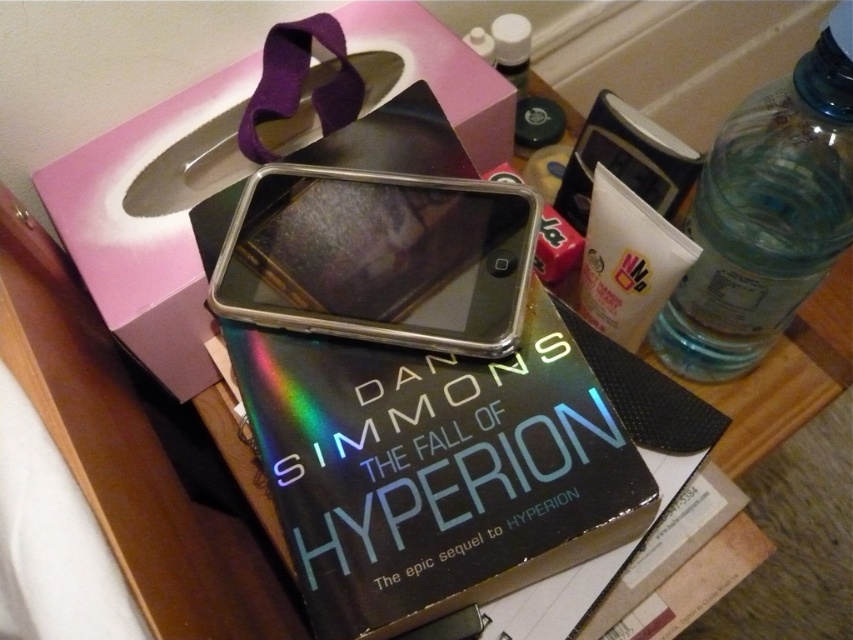
Between point (235, 316) and point (672, 321), which one is positioned in front?

Point (235, 316) is in front.

Can you confirm if clear plastic phone at center is bigger than clear plastic bottle at right?

Incorrect, clear plastic phone at center is not larger than clear plastic bottle at right.

Who is more distant from viewer, (277,214) or (703,253)?

Point (703,253)

I want to click on clear plastic phone at center, so click(379, 259).

Who is more forward, (225, 326) or (819, 68)?

Positioned in front is point (819, 68).

Does point (254, 410) lie behind point (787, 198)?

No, (254, 410) is closer to viewer.

Where is `holographic hardcover book at center`? Image resolution: width=853 pixels, height=640 pixels. holographic hardcover book at center is located at coordinates (434, 468).

Is point (260, 365) less distant than point (387, 186)?

Yes, point (260, 365) is in front of point (387, 186).

Is holographic hardcover book at center wider than clear plastic phone at center?

Yes.

Identify the location of holographic hardcover book at center. This screenshot has width=853, height=640. (434, 468).

Where is `holographic hardcover book at center`? holographic hardcover book at center is located at coordinates (434, 468).